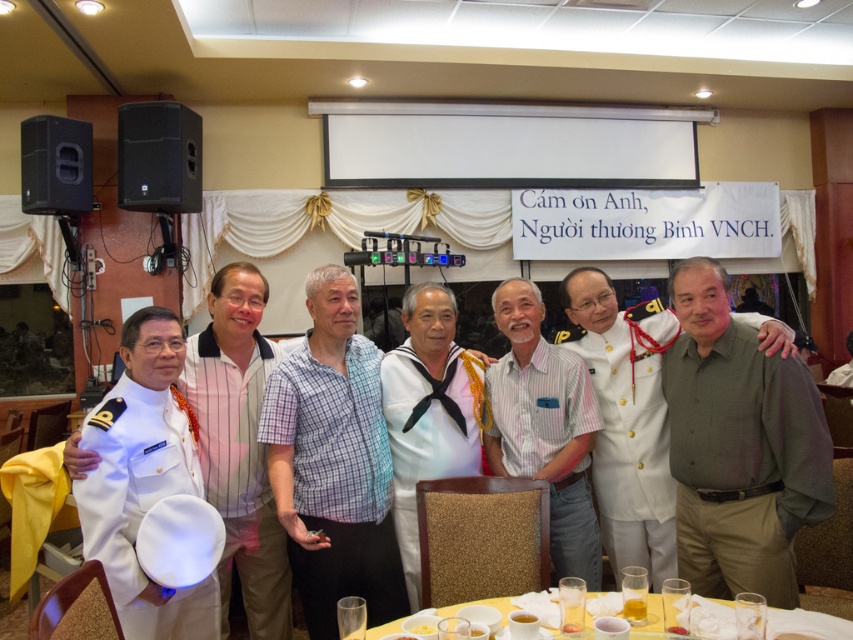
You are a photographer standing in front of the group. You need to adjust your camera focus so that both the white uniform at left and the white striped shirt at center are in focus. Which person should you focus on first to ensure both are sharp?

You should focus on the white uniform at left first because it is closer to you than the white striped shirt at center, so focusing on the closer object will help ensure both are in focus.

You are standing in the banquet hall and see the point marked at coordinate (x=369, y=570). If you want to place a small flower arrangement there, will it be within your reach if you can extend your arm 1.8 meters? Please explain.

The point at coordinate (x=369, y=570) is 2.40 meters away from the viewer. Since your arm can only extend 1.8 meters, you won

You are a photographer adjusting the camera height to ensure both the white uniform at left and the white striped shirt at center are in focus. Which person should you adjust the camera angle to focus on first, the taller one or the shorter one?

The white uniform at left is taller than the white striped shirt at center, so you should focus on the white uniform at left first to ensure proper framing.